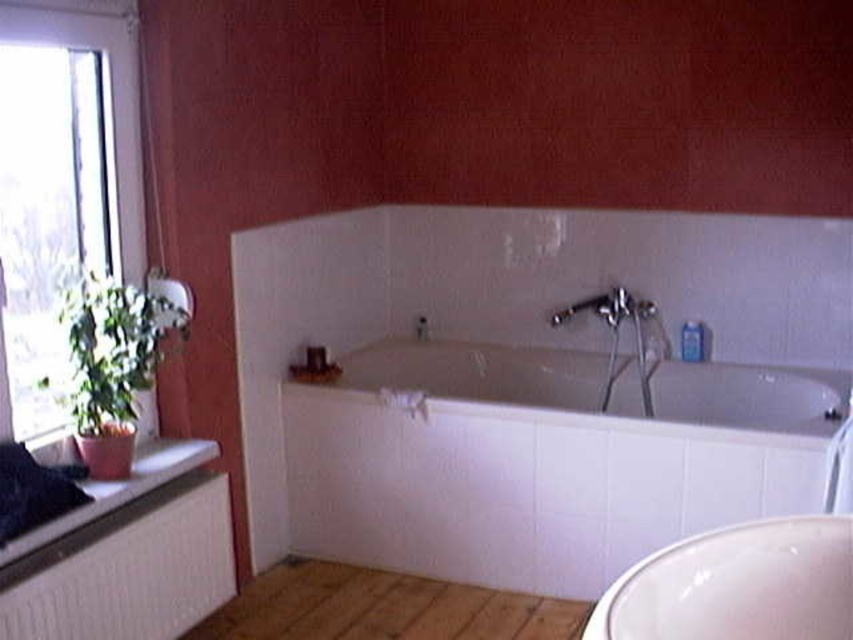
Question: Which object is positioned farthest from the brown wood floor at lower center?

Choices:
 (A) transparent glass window at left
 (B) white glossy bathtub at center
 (C) matte white window sill at lower left

Answer: (A)

Question: Which point is closer to the camera taking this photo?

Choices:
 (A) tap(704, 506)
 (B) tap(177, 444)
 (C) tap(387, 625)

Answer: (B)

Question: Does white glossy sink at lower right lie behind brown wood floor at lower center?

Choices:
 (A) no
 (B) yes

Answer: (A)

Question: Can you confirm if white glossy bathtub at center is positioned above matte silver faucet at center?

Choices:
 (A) yes
 (B) no

Answer: (B)

Question: Considering the relative positions of white textured radiator at lower left and white glossy sink at lower right in the image provided, where is white textured radiator at lower left located with respect to white glossy sink at lower right?

Choices:
 (A) left
 (B) right

Answer: (A)

Question: Which object appears closest to the camera in this image?

Choices:
 (A) white textured radiator at lower left
 (B) matte silver faucet at center

Answer: (A)